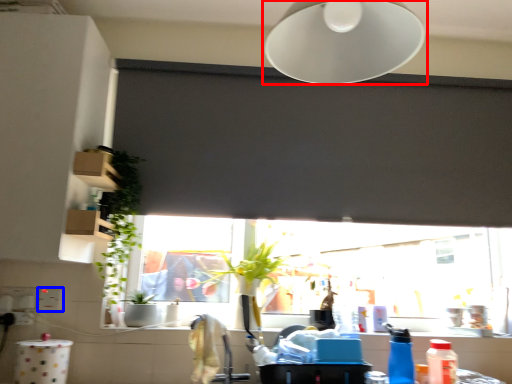
Question: Which object is closer to the camera taking this photo, lamp (highlighted by a red box) or electric outlet (highlighted by a blue box)?

Choices:
 (A) lamp
 (B) electric outlet

Answer: (A)